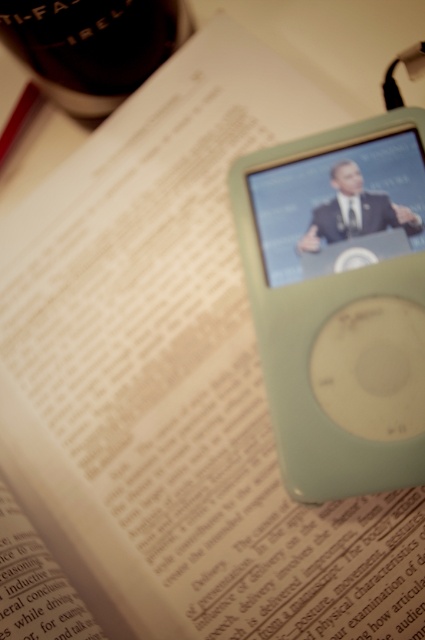
You are trying to place a 12 inch ruler between the light green plastic ipod at center and the black glass bottle at top left. Will the ruler fit between them?

The distance between the light green plastic ipod at center and the black glass bottle at top left is 15.52 inches, so the 12 inch ruler will fit between them since it is shorter than the distance between the two objects.

You are organizing items on a desk and need to place the light green plastic ipod at center and the black glass bottle at top left. Based on their positions, which item is closer to you?

The black glass bottle at top left is closer to you because it is above the light green plastic ipod at center, which is positioned below it.

You have a small desk where you want to place both the light green plastic ipod at center and the black glass bottle at top left. If the desk space is only 10 cm wide, can both items fit side by side?

The light green plastic ipod at center is narrower than the black glass bottle at top left. However, without knowing the exact width of either item, it is impossible to determine if both can fit within 10 cm. More information is needed about their individual dimensions.